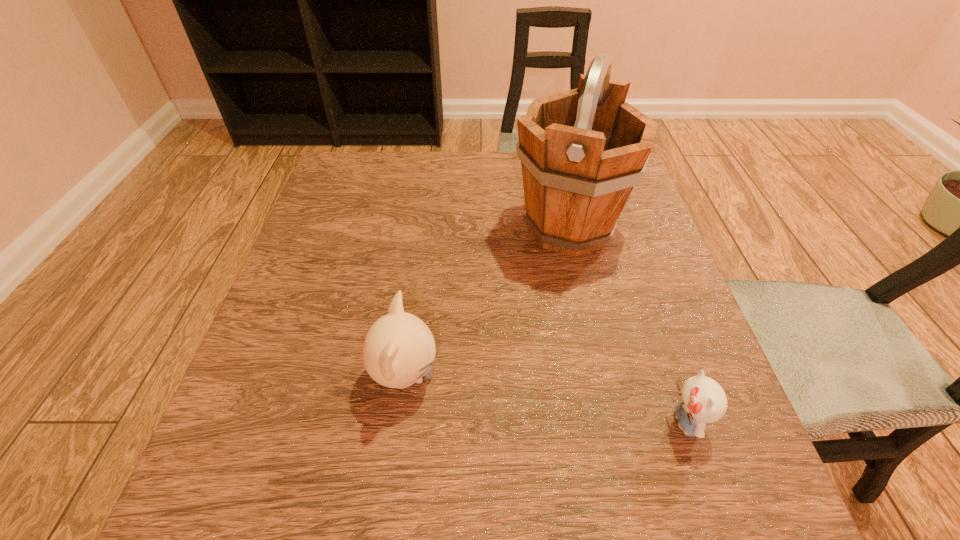
Identify which object is the second closest to the bucket. Please provide its 2D coordinates. Your answer should be formatted as a tuple, i.e. [(x, y)], where the tuple contains the x and y coordinates of a point satisfying the conditions above.

[(702, 400)]

The height and width of the screenshot is (540, 960). What are the coordinates of `the second closest object to the shorter kitten` in the screenshot? It's located at (399, 349).

Identify the location of vacant area in the image that satisfies the following two spatial constraints: 1. on the front side of the farthest object; 2. on the face of the second tallest object. This screenshot has height=540, width=960. (601, 376).